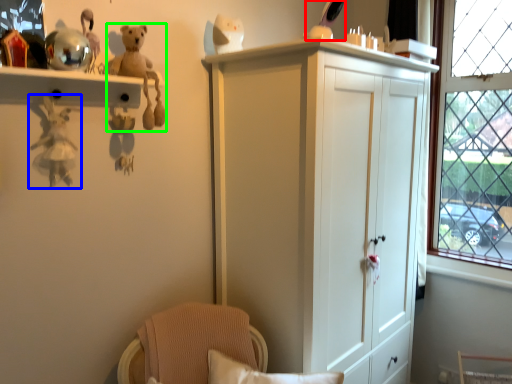
Question: Which object is positioned farthest from toy (highlighted by a red box)? Select from toy (highlighted by a blue box) and toy (highlighted by a green box).

Choices:
 (A) toy
 (B) toy

Answer: (A)